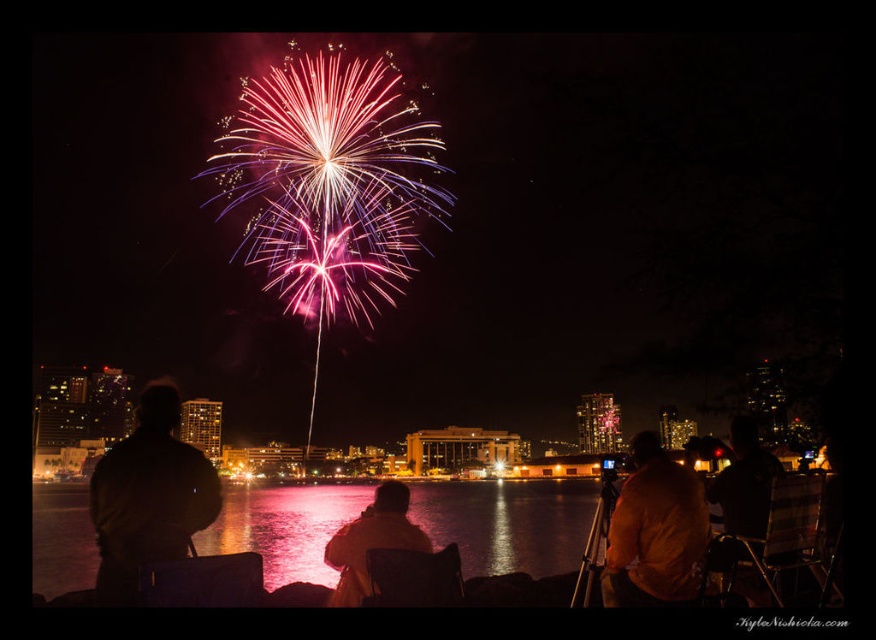
Question: Among these objects, which one is nearest to the camera?

Choices:
 (A) matte yellow jacket at center
 (B) glossy reflective water at center

Answer: (A)

Question: Is dark brown leather jacket at left thinner than matte yellow jacket at center?

Choices:
 (A) no
 (B) yes

Answer: (A)

Question: Can you confirm if glossy reflective water at center is wider than matte yellow jacket at center?

Choices:
 (A) yes
 (B) no

Answer: (A)

Question: Based on their relative distances, which object is farther from the matte yellow jacket at center?

Choices:
 (A) dark brown leather jacket at left
 (B) glossy reflective water at center
 (C) orange cotton shirt at lower right

Answer: (C)

Question: Observing the image, what is the correct spatial positioning of glossy reflective water at center in reference to matte yellow jacket at center?

Choices:
 (A) above
 (B) below

Answer: (A)

Question: Among these points, which one is farthest from the camera?

Choices:
 (A) (382, 493)
 (B) (36, 499)
 (C) (676, 484)

Answer: (B)